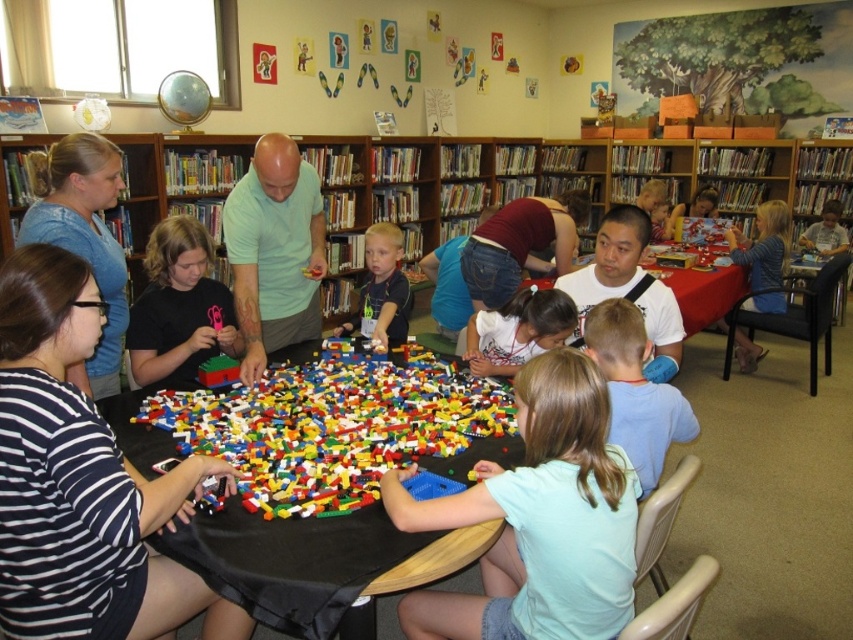
Who is taller, blue denim shirt at upper left or smooth blue shirt at center?

Answer: blue denim shirt at upper left

Does blue denim shirt at upper left appear over smooth blue shirt at center?

Yes, blue denim shirt at upper left is above smooth blue shirt at center.

Locate an element on the screen. The height and width of the screenshot is (640, 853). blue denim shirt at upper left is located at coordinates (83, 236).

Is black fabric table at center above light green shirt at center?

No, black fabric table at center is not above light green shirt at center.

Which is in front, point (225, 538) or point (260, 310)?

Point (225, 538) is in front.

The height and width of the screenshot is (640, 853). Find the location of `black fabric table at center`. black fabric table at center is located at coordinates (312, 554).

Between blue cotton shirt at lower center and white matte shirt at center, which one has more height?

Standing taller between the two is blue cotton shirt at lower center.

Does blue cotton shirt at lower center have a lesser width compared to white matte shirt at center?

Yes.

Who is more forward, (631, 436) or (508, 355)?

Point (631, 436) is in front.

Where is `blue cotton shirt at lower center`? This screenshot has width=853, height=640. blue cotton shirt at lower center is located at coordinates (635, 390).